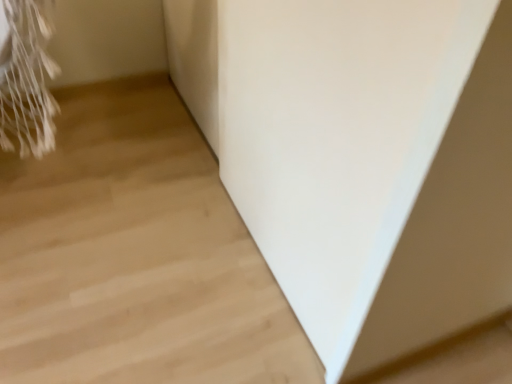
Locate an element on the screen. The image size is (512, 384). white matte cabinet at center is located at coordinates (362, 158).

The image size is (512, 384). What do you see at coordinates (362, 158) in the screenshot?
I see `white matte cabinet at center` at bounding box center [362, 158].

I want to click on white matte cabinet at center, so click(362, 158).